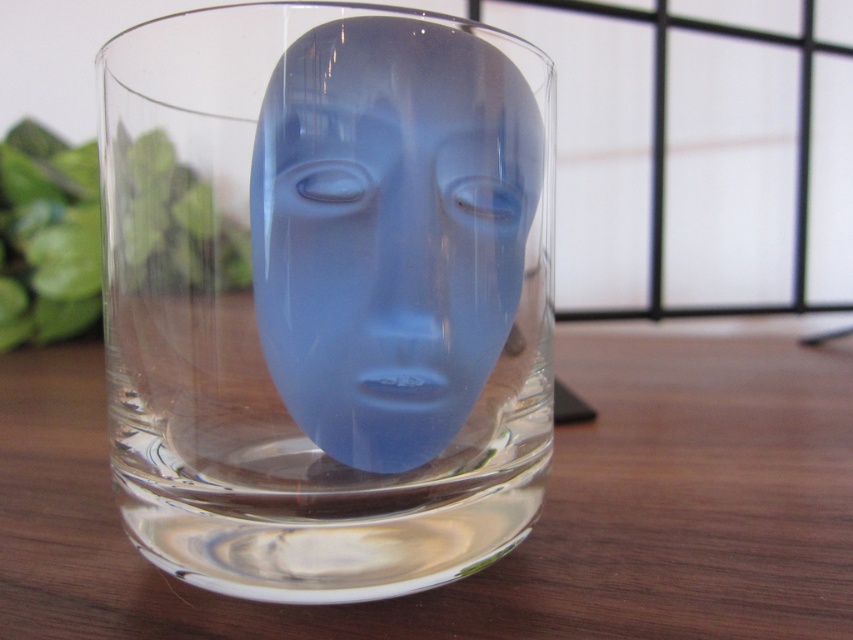
Question: Does wooden table at center have a smaller size compared to satin blue mask at center?

Choices:
 (A) no
 (B) yes

Answer: (A)

Question: Which object is the farthest from the transparent glass mask at center?

Choices:
 (A) wooden table at center
 (B) satin blue mask at center

Answer: (A)

Question: Can you confirm if wooden table at center is positioned to the left of satin blue mask at center?

Choices:
 (A) yes
 (B) no

Answer: (A)

Question: Which object appears farthest from the camera in this image?

Choices:
 (A) wooden table at center
 (B) satin blue mask at center

Answer: (A)

Question: Is transparent glass mask at center above wooden table at center?

Choices:
 (A) no
 (B) yes

Answer: (B)

Question: Which object is closer to the camera taking this photo?

Choices:
 (A) transparent glass mask at center
 (B) wooden table at center
 (C) satin blue mask at center

Answer: (A)